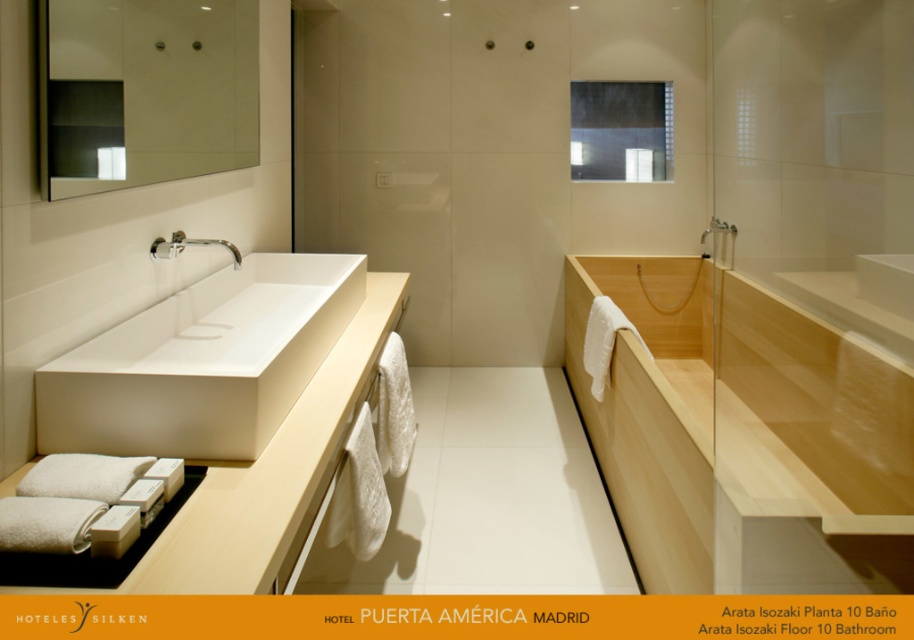
You are a home inspector checking the bathroom layout. You need to determine if the clear glass mirror at upper left is positioned above the silver metallic faucet at upper left. Based on the scene description, what is the relationship between these two items?

The clear glass mirror at upper left is above the silver metallic faucet at upper left according to the description.

You are holding a camera and want to take a photo of the clear glass mirror at upper left. If you stand exactly where the camera is positioned in the image, will you be able to capture the entire mirror in the frame without moving? The camera has a standard field of view and can capture a 1.5 meter width at this distance.

The clear glass mirror at upper left and camera are 1.42 meters apart. Since the camera can capture a 1.5 meter width at this distance, the entire mirror can fit within the frame as 1.42 meters is less than 1.5 meters.

In the scene shown: You are a plumber working on the bathroom fixtures. You need to replace the silver metallic faucet at upper left but first must ensure there is enough space between it and the clear glass mirror at upper left to access the pipes. The minimum required space for the tools is 40 centimeters. Can you safely work there?

The distance between the clear glass mirror at upper left and the silver metallic faucet at upper left is 42.66 centimeters, which exceeds the minimum required space of 40 centimeters. Therefore, you can safely work there with enough room for your tools.